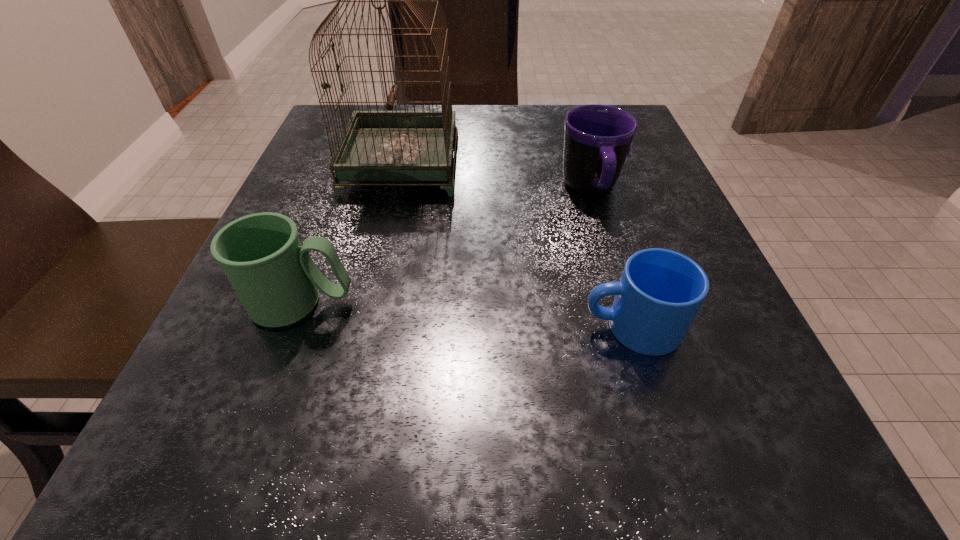
This screenshot has height=540, width=960. In order to click on object that is positioned at the far edge in this screenshot , I will do `click(376, 146)`.

This screenshot has width=960, height=540. I want to click on birdcage present at the left edge, so click(376, 146).

Where is `mug located in the left edge section of the desktop`? The image size is (960, 540). mug located in the left edge section of the desktop is located at coordinates (275, 278).

Find the location of a particular element. object situated at the far left corner is located at coordinates (376, 146).

Identify the location of vacant space at the near edge of the desktop. (343, 505).

The image size is (960, 540). In the image, there is a desktop. Identify the location of vacant space at the left edge. (306, 167).

Identify the location of vacant point at the right edge. The width and height of the screenshot is (960, 540). (756, 383).

Image resolution: width=960 pixels, height=540 pixels. In order to click on free spot at the far left corner of the desktop in this screenshot , I will do (x=323, y=124).

Locate an element on the screen. This screenshot has height=540, width=960. vacant space at the near left corner of the desktop is located at coordinates [x=211, y=445].

Where is `free region at the near right corner of the desktop`? Image resolution: width=960 pixels, height=540 pixels. free region at the near right corner of the desktop is located at coordinates (713, 430).